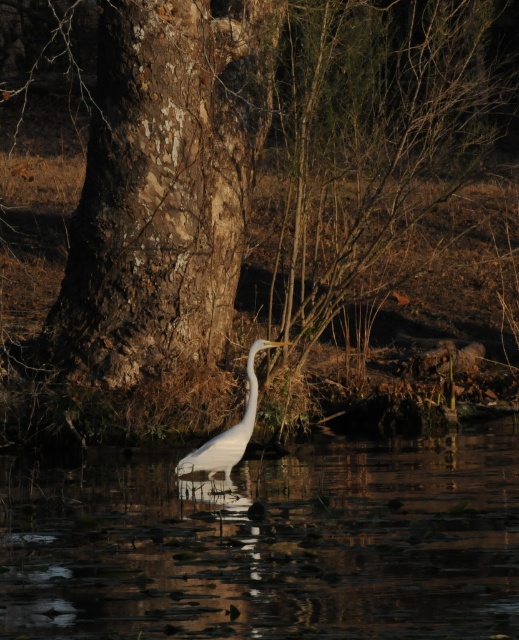
Does brown rough tree trunk at center appear under rough bark tree trunk at center?

No.

Measure the distance from brown rough tree trunk at center to rough bark tree trunk at center.

brown rough tree trunk at center is 1.77 meters from rough bark tree trunk at center.

This screenshot has width=519, height=640. What do you see at coordinates (250, 202) in the screenshot? I see `brown rough tree trunk at center` at bounding box center [250, 202].

Where is `brown rough tree trunk at center`? The image size is (519, 640). brown rough tree trunk at center is located at coordinates (250, 202).

Is point (155, 184) closer to camera compared to point (256, 394)?

That is False.

Is rough bark tree trunk at center taller than white smooth heron at center?

Correct, rough bark tree trunk at center is much taller as white smooth heron at center.

Locate an element on the screen. rough bark tree trunk at center is located at coordinates (163, 186).

Which is behind, point (475, 84) or point (239, 458)?

Point (475, 84)

Which is below, brown rough tree trunk at center or white smooth heron at center?

white smooth heron at center

Which is in front, point (443, 44) or point (220, 465)?

Positioned in front is point (220, 465).

In order to click on brown rough tree trunk at center in this screenshot , I will do `click(250, 202)`.